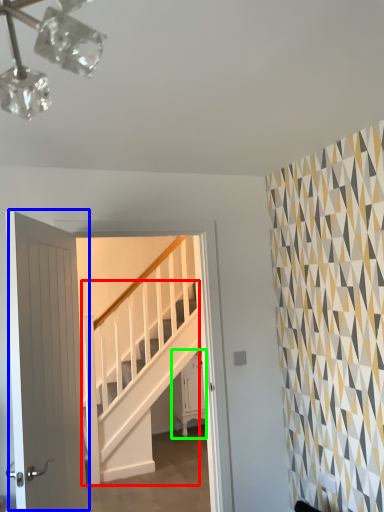
Question: Which is farther away from stairs (highlighted by a red box)? door (highlighted by a blue box) or furniture (highlighted by a green box)?

Choices:
 (A) door
 (B) furniture

Answer: (A)